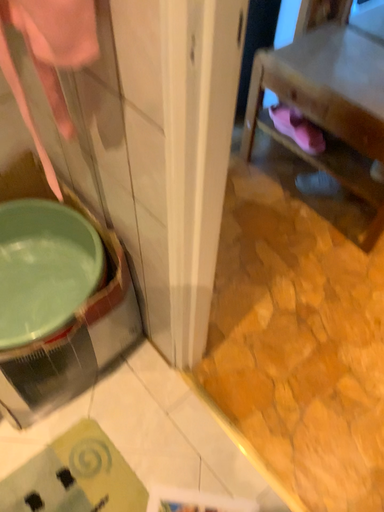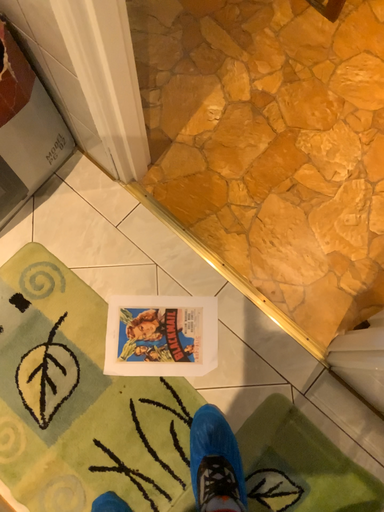
Question: How did the camera likely rotate when shooting the video?

Choices:
 (A) rotated downward
 (B) rotated upward

Answer: (A)